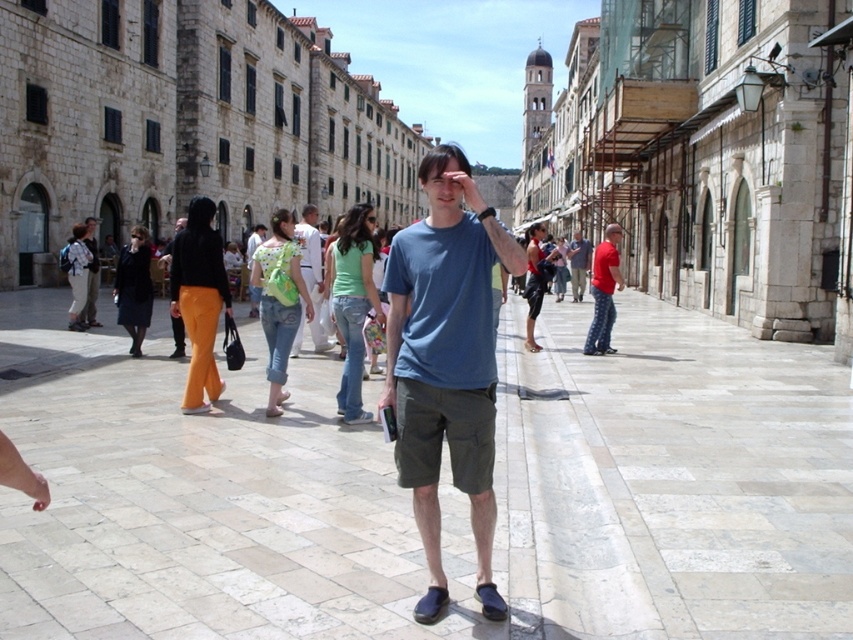
Looking at this image, you are a photographer standing on the street and want to capture both the red cotton shirt at right and the matte blue shirt at center in a single photo. Which shirt should you focus on to ensure both are in frame without moving your camera?

The red cotton shirt at right is larger in size than the matte blue shirt at center, so focusing on the red cotton shirt at right would ensure both are in frame since it occupies more space in the image.